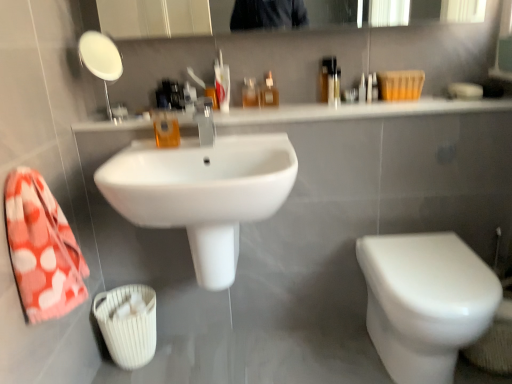
You are a GUI agent. You are given a task and a screenshot of the screen. Output one action in this format:
    pyautogui.click(x=<x>, y=<y>)
    Task: Click on the free space underneath white glossy sink at center (from a real-world perspective)
    
    Given the screenshot: What is the action you would take?
    pyautogui.click(x=224, y=357)